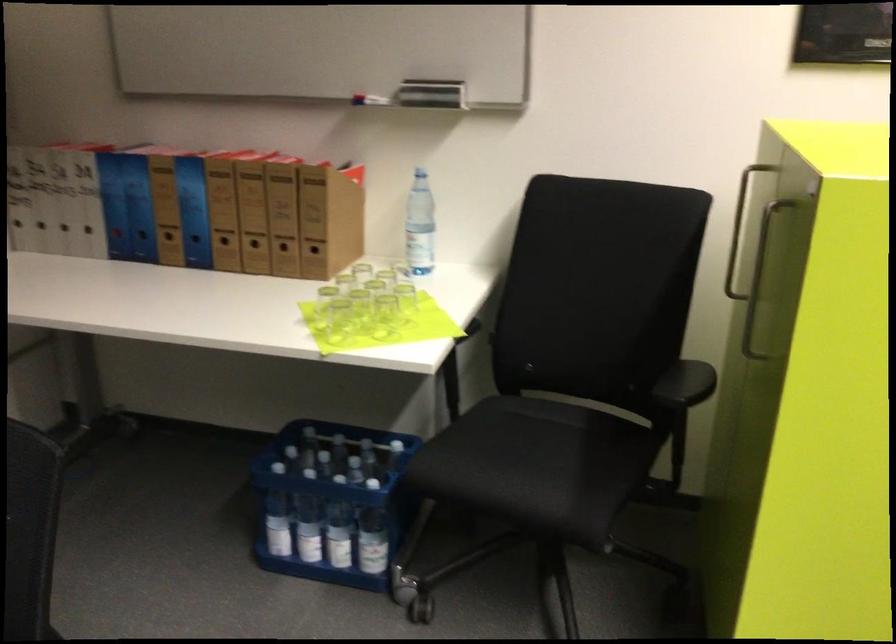
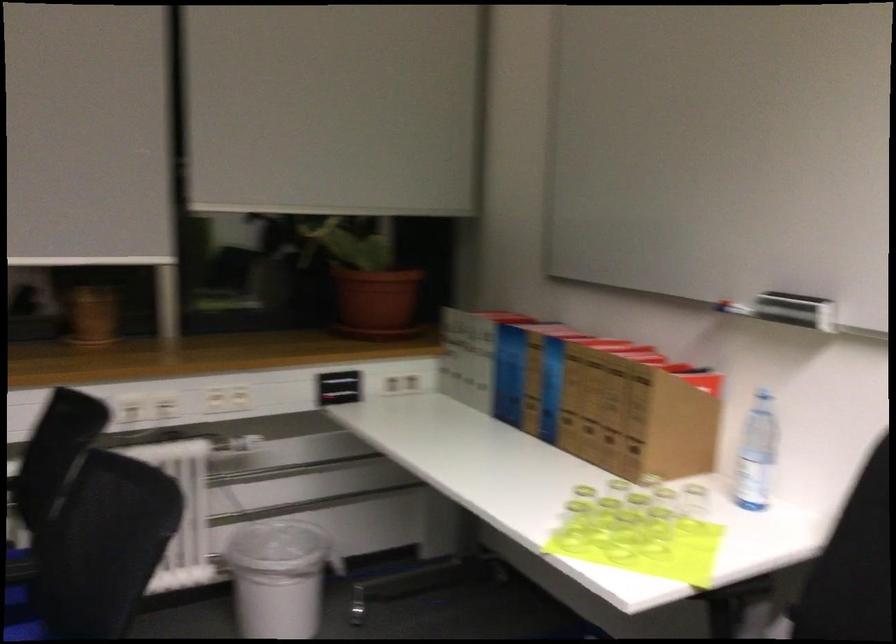
The point at (383, 310) is marked in the first image. Where is the corresponding point in the second image?

(655, 534)